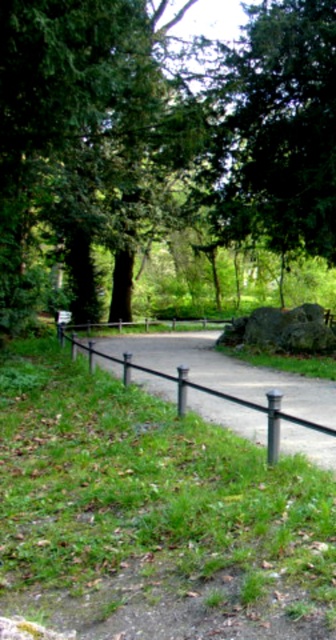
Is green metallic pole at center shorter than black metal pole at center?

Yes, green metallic pole at center is shorter than black metal pole at center.

Which is above, green metallic pole at center or black metal pole at center?

Positioned higher is black metal pole at center.

Where is `green metallic pole at center`? This screenshot has height=640, width=336. green metallic pole at center is located at coordinates (272, 426).

The image size is (336, 640). I want to click on green metallic pole at center, so (272, 426).

Can you confirm if green leafy tree at center is thinner than green metallic pole at center?

In fact, green leafy tree at center might be wider than green metallic pole at center.

Can you confirm if green leafy tree at center is bigger than green metallic pole at center?

Indeed, green leafy tree at center has a larger size compared to green metallic pole at center.

Is point (68, 49) positioned behind point (270, 433)?

Yes, it is behind point (270, 433).

At what (x,y) coordinates should I click in order to perform the action: click on green leafy tree at center. Please return your answer as a coordinate pair (x, y). The height and width of the screenshot is (640, 336). Looking at the image, I should click on (160, 138).

Who is more forward, (82, 36) or (185, 410)?

Point (185, 410) is in front.

Does green leafy tree at center have a smaller size compared to black metal pole at center?

Actually, green leafy tree at center might be larger than black metal pole at center.

Describe the element at coordinates (160, 138) in the screenshot. This screenshot has height=640, width=336. I see `green leafy tree at center` at that location.

Identify the location of green leafy tree at center. (160, 138).